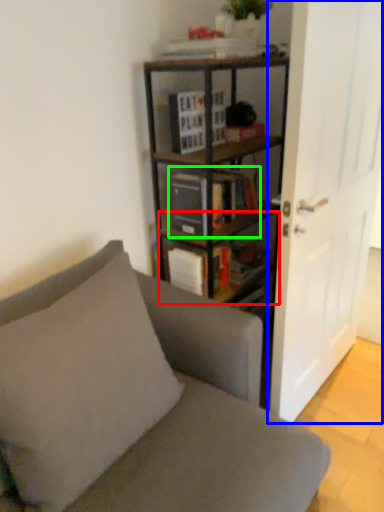
Question: Based on their relative distances, which object is farther from shelf (highlighted by a red box)? Choose from door (highlighted by a blue box) and book (highlighted by a green box).

Choices:
 (A) door
 (B) book

Answer: (A)